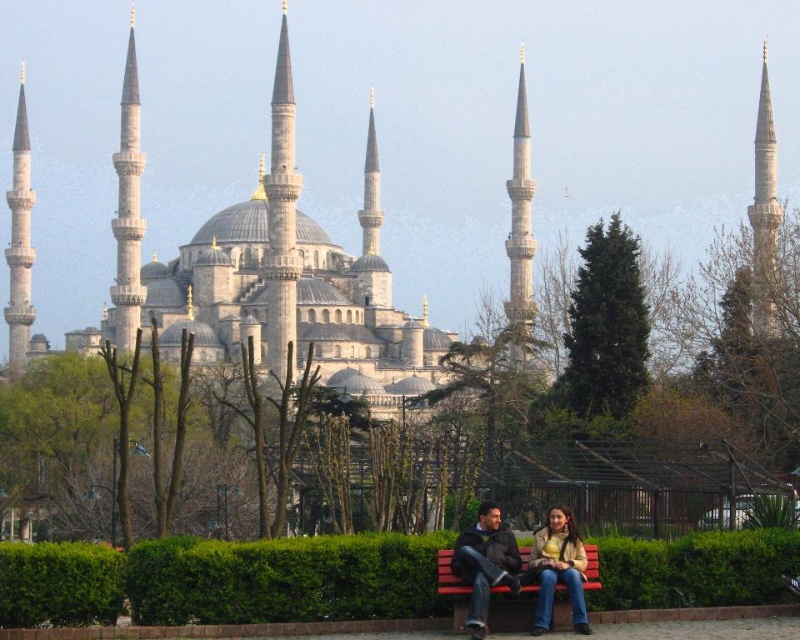
Does jeans at center appear over dark brown leather jacket at lower center?

Actually, jeans at center is below dark brown leather jacket at lower center.

Is jeans at center further to camera compared to dark brown leather jacket at lower center?

No, it is not.

Between point (516, 552) and point (466, 625), which one is positioned in front?

Point (466, 625) is in front.

Find the location of a particular element. jeans at center is located at coordinates (520, 566).

Who is positioned more to the right, dark brown leather jacket at lower center or light brown leather jacket at lower center?

light brown leather jacket at lower center is more to the right.

Between dark brown leather jacket at lower center and light brown leather jacket at lower center, which one is positioned higher?

dark brown leather jacket at lower center is higher up.

The width and height of the screenshot is (800, 640). In order to click on dark brown leather jacket at lower center in this screenshot , I will do (486, 563).

Does jeans at center have a greater height compared to light brown leather jacket at lower center?

Correct, jeans at center is much taller as light brown leather jacket at lower center.

Between jeans at center and light brown leather jacket at lower center, which one is positioned higher?

light brown leather jacket at lower center

I want to click on jeans at center, so click(x=520, y=566).